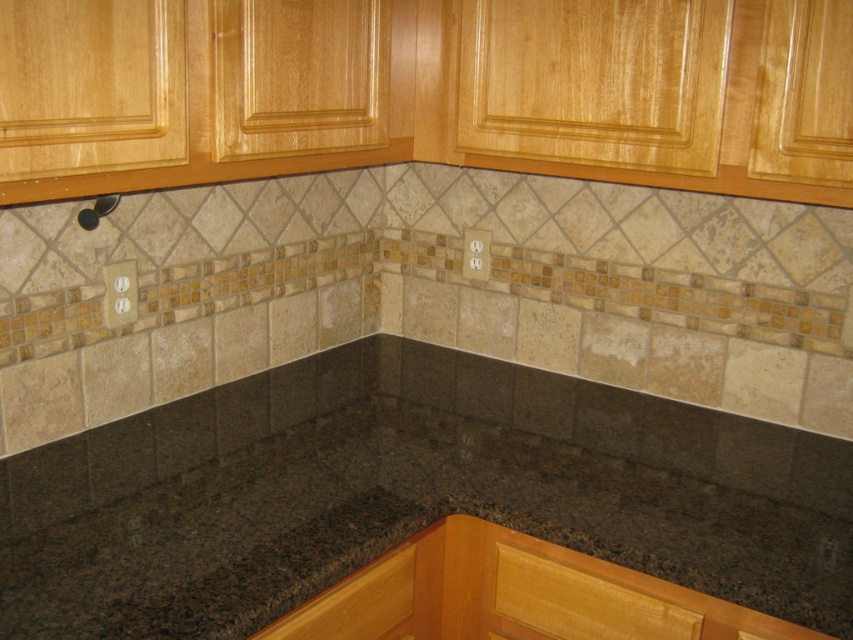
Is black granite countertop at center wider than wooden drawer at lower center?

Correct, the width of black granite countertop at center exceeds that of wooden drawer at lower center.

Where is `black granite countertop at center`? The image size is (853, 640). black granite countertop at center is located at coordinates (407, 493).

Describe the element at coordinates (407, 493) in the screenshot. I see `black granite countertop at center` at that location.

The image size is (853, 640). Find the location of `black granite countertop at center`. black granite countertop at center is located at coordinates (407, 493).

Which of these two, light wood drawer at lower right or wooden drawer at lower center, stands shorter?

wooden drawer at lower center is shorter.

Does light wood drawer at lower right come behind wooden drawer at lower center?

Yes, light wood drawer at lower right is further from the viewer.

Who is more distant from viewer, (610, 634) or (328, 616)?

Positioned behind is point (610, 634).

Locate an element on the screen. The height and width of the screenshot is (640, 853). light wood drawer at lower right is located at coordinates (581, 602).

Is point (590, 428) closer to camera compared to point (589, 634)?

No, (590, 428) is behind (589, 634).

Which is more to the right, black granite countertop at center or light wood drawer at lower right?

light wood drawer at lower right

Locate an element on the screen. The image size is (853, 640). black granite countertop at center is located at coordinates (407, 493).